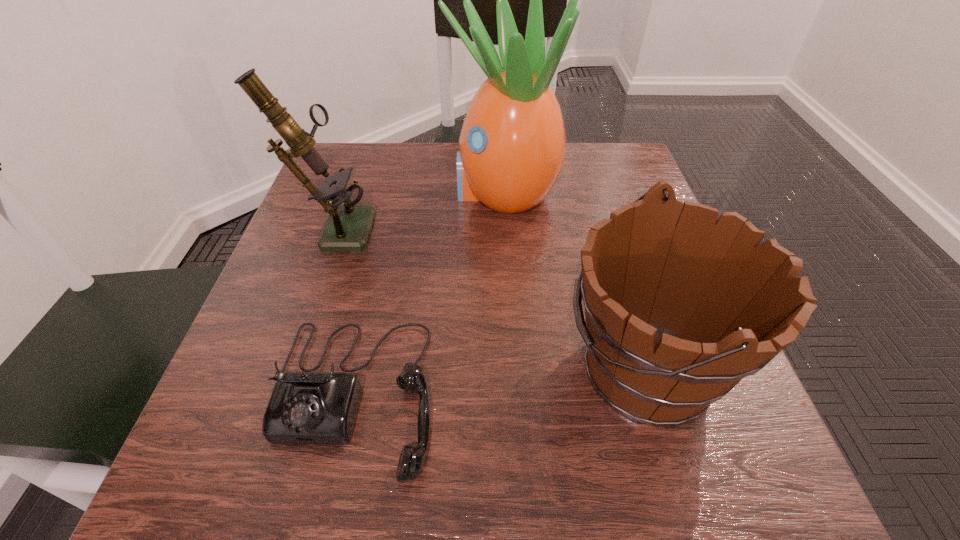
Identify the location of free space that satisfies the following two spatial constraints: 1. at the entrance of the pineapple; 2. on the dial of the shortest object. (516, 396).

Identify the location of free spot that satisfies the following two spatial constraints: 1. with the handle on the wine bucket; 2. on the dial of the shortest object. The width and height of the screenshot is (960, 540). (653, 396).

At what (x,y) coordinates should I click in order to perform the action: click on vacant space that satisfies the following two spatial constraints: 1. with the handle on the second shortest object; 2. on the dial of the shortest object. Please return your answer as a coordinate pair (x, y). The image size is (960, 540). Looking at the image, I should click on coord(653,396).

Identify the location of free spot that satisfies the following two spatial constraints: 1. at the entrance of the pineapple; 2. on the dial of the telephone. (516, 396).